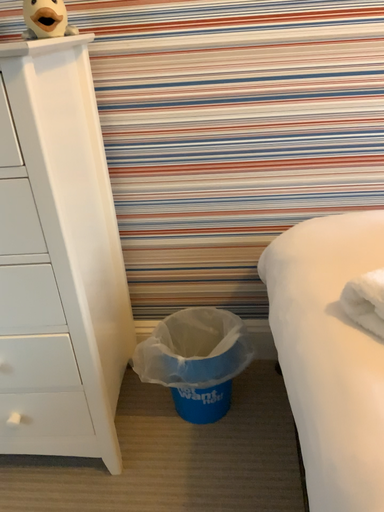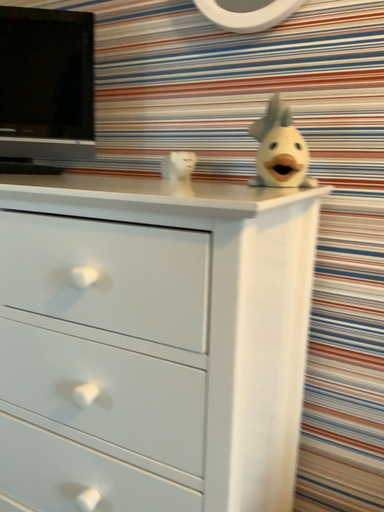
Question: Which way did the camera rotate in the video?

Choices:
 (A) rotated left
 (B) rotated right

Answer: (A)